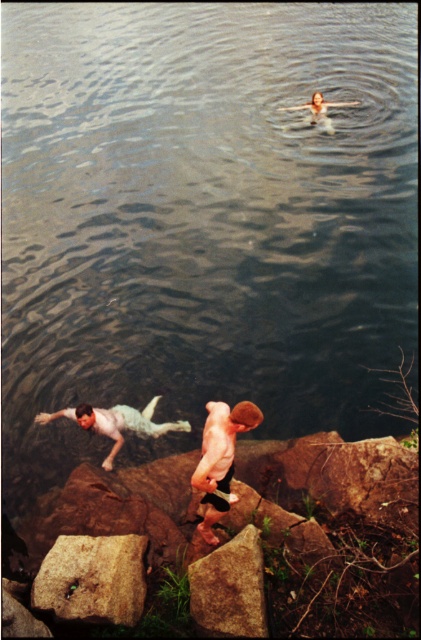
Looking at this image, who is shorter, smooth skin man at center or light blue fabric swim trunks at left?

With less height is light blue fabric swim trunks at left.

Is smooth skin man at center to the right of light blue fabric swim trunks at left from the viewer's perspective?

Yes, smooth skin man at center is to the right of light blue fabric swim trunks at left.

The width and height of the screenshot is (421, 640). What are the coordinates of `smooth skin man at center` in the screenshot? It's located at (221, 458).

Can you confirm if brown rough rock at center is thinner than light blue fabric swim trunks at left?

Indeed, brown rough rock at center has a lesser width compared to light blue fabric swim trunks at left.

Between brown rough rock at center and light blue fabric swim trunks at left, which one has more height?

light blue fabric swim trunks at left is taller.

Image resolution: width=421 pixels, height=640 pixels. Describe the element at coordinates (229, 588) in the screenshot. I see `brown rough rock at center` at that location.

Locate an element on the screen. brown rough rock at center is located at coordinates (229, 588).

Does rough textured rock at lower left appear on the left side of light blue fabric swim trunks at left?

Incorrect, rough textured rock at lower left is not on the left side of light blue fabric swim trunks at left.

Between rough textured rock at lower left and light blue fabric swim trunks at left, which one appears on the left side from the viewer's perspective?

Positioned to the left is light blue fabric swim trunks at left.

Measure the distance between rough textured rock at lower left and camera.

rough textured rock at lower left is 5.53 meters away from camera.

Image resolution: width=421 pixels, height=640 pixels. Identify the location of rough textured rock at lower left. (93, 579).